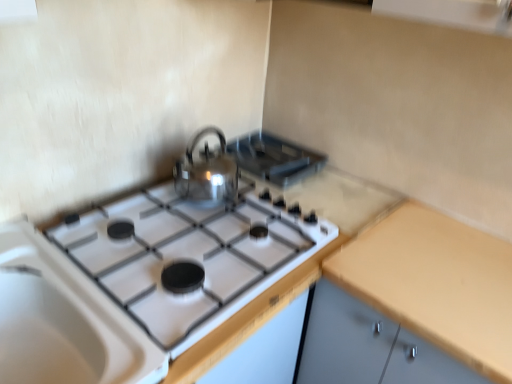
Question: Is point (266, 140) closer or farther from the camera than point (223, 135)?

Choices:
 (A) farther
 (B) closer

Answer: (A)

Question: Based on their sizes in the image, would you say satin silver kettle at upper center is bigger or smaller than shiny metallic kettle at center?

Choices:
 (A) small
 (B) big

Answer: (A)

Question: Which object is positioned closest to the white glossy gas stove at center?

Choices:
 (A) satin silver kettle at upper center
 (B) yellow matte countertop at right
 (C) shiny metallic kettle at center

Answer: (C)

Question: Which object is the farthest from the shiny metallic kettle at center?

Choices:
 (A) yellow matte countertop at right
 (B) satin silver kettle at upper center
 (C) white glossy gas stove at center

Answer: (A)